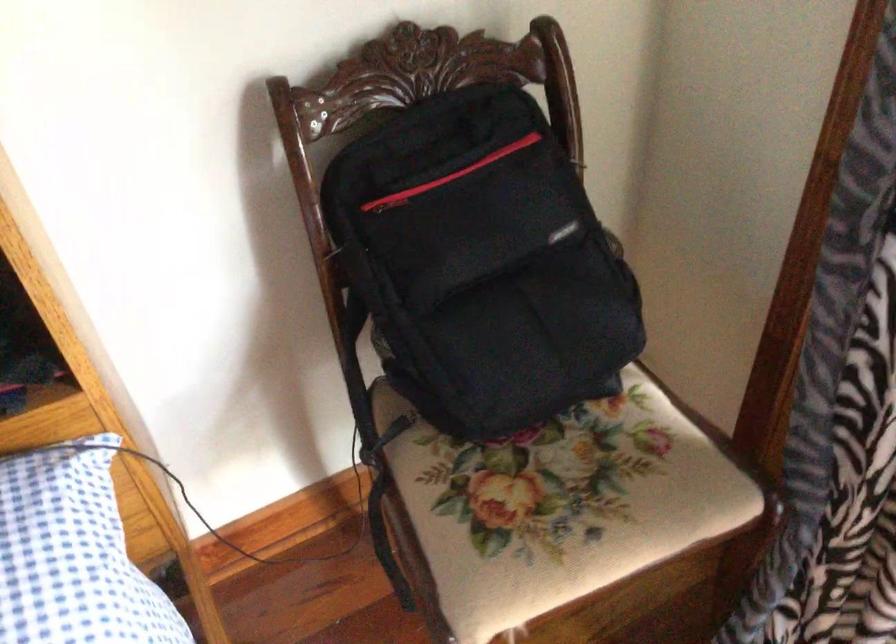
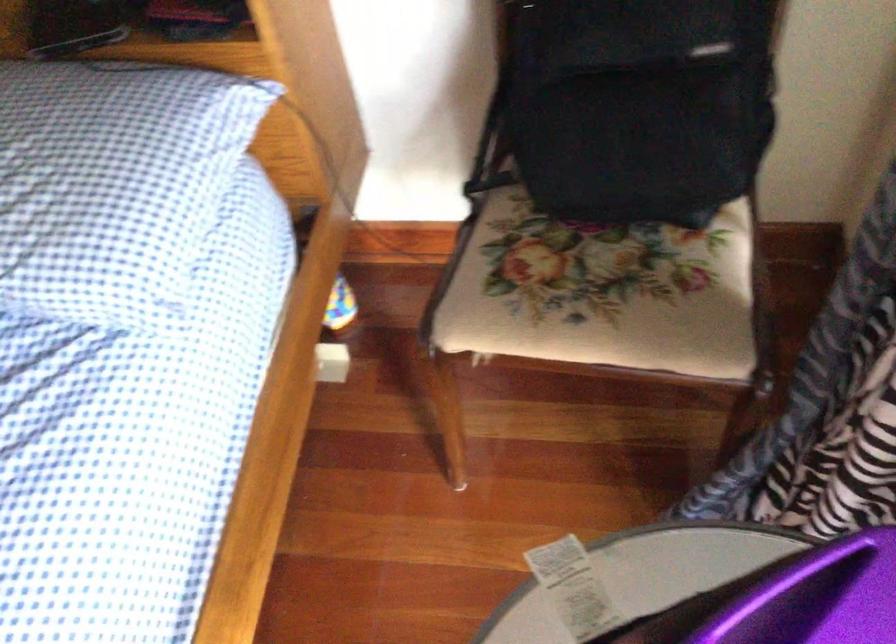
Where in the second image is the point corresponding to point (530, 299) from the first image?

(639, 104)